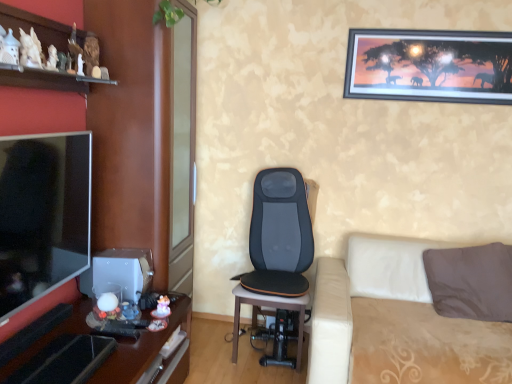
You are a GUI agent. You are given a task and a screenshot of the screen. Output one action in this format:
    pyautogui.click(x=<x>, y=<y>)
    Task: Click on the vacant space underneath metallic-framed picture at upper right (from a real-world perspective)
    This screenshot has width=512, height=384.
    Given the screenshot: What is the action you would take?
    pyautogui.click(x=418, y=235)